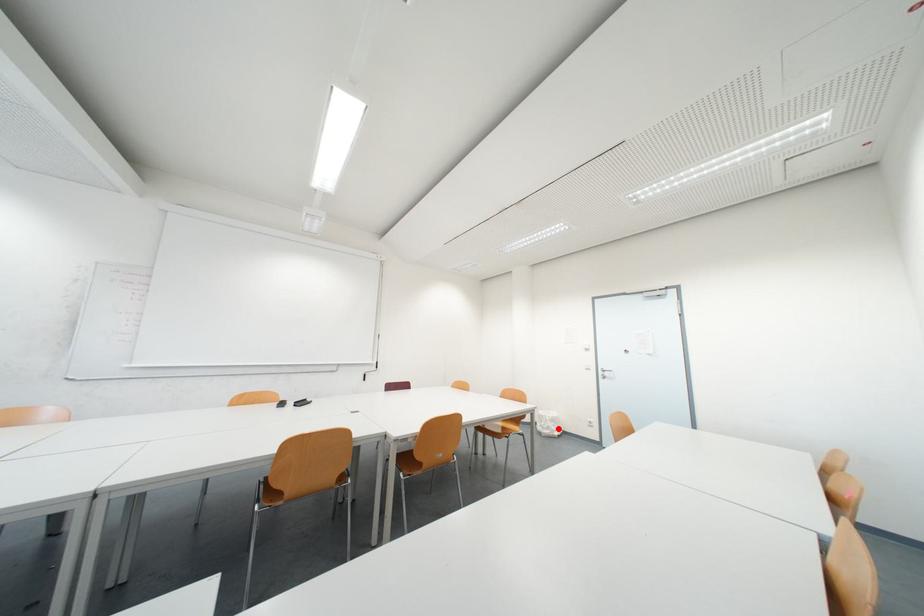
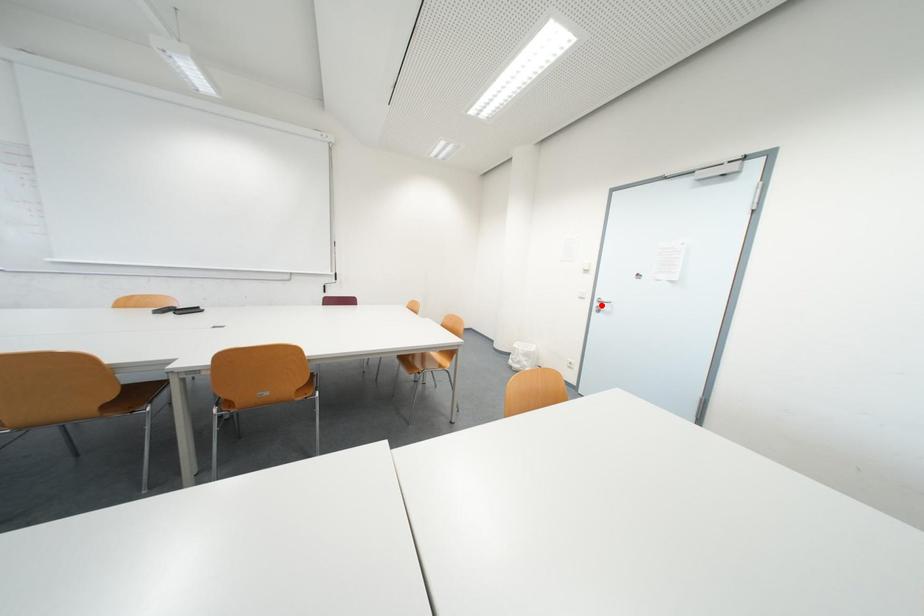
I am providing you with two images of the same scene from different viewpoints. A red point is marked on the first image and another point is marked on the second image. Is the red point in image1 aligned with the point shown in image2?

No